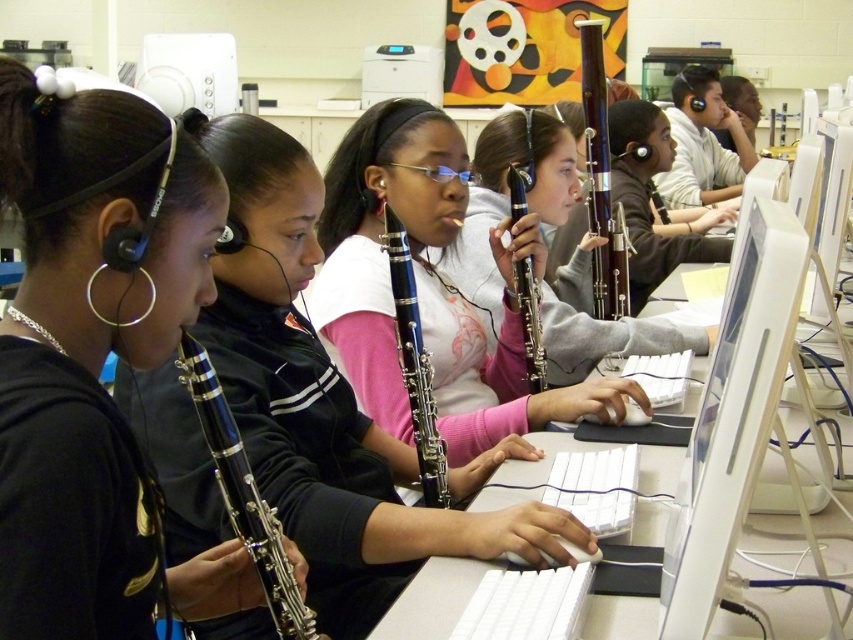
Question: Is white glossy monitor at center right to the left of blue glossy clarinet at center from the viewer's perspective?

Choices:
 (A) no
 (B) yes

Answer: (A)

Question: Can you confirm if dark brown wood bassoon at center is bigger than blue glossy clarinet at center?

Choices:
 (A) no
 (B) yes

Answer: (B)

Question: Which object is closer to the camera taking this photo?

Choices:
 (A) matte blue clarinet at center
 (B) white glossy monitor at center right
 (C) black glossy clarinet at center
 (D) dark brown wood bassoon at center

Answer: (B)

Question: Estimate the real-world distances between objects in this image. Which object is farther from the matte black clarinet at center?

Choices:
 (A) white glossy monitor at center right
 (B) blue glossy clarinet at center

Answer: (A)

Question: Estimate the real-world distances between objects in this image. Which object is farther from the white glossy monitor at center right?

Choices:
 (A) black glossy clarinet at center
 (B) matte blue clarinet at center
 (C) dark brown wood bassoon at center
 (D) blue glossy clarinet at center

Answer: (C)

Question: Does white glossy monitor at center right appear over black glossy clarinet at center?

Choices:
 (A) no
 (B) yes

Answer: (B)